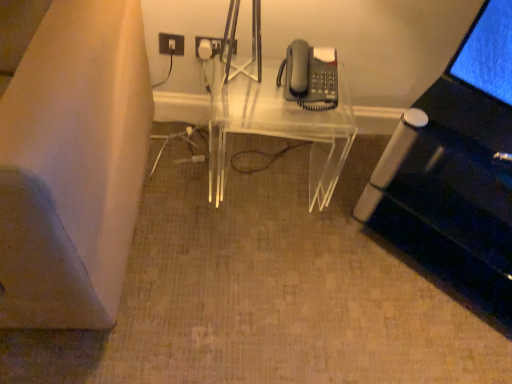
Question: Is transparent acrylic table at center at the back of white plastic electrical outlet at upper center?

Choices:
 (A) no
 (B) yes

Answer: (A)

Question: Is there a large distance between white plastic electrical outlet at upper center and transparent acrylic table at center?

Choices:
 (A) yes
 (B) no

Answer: (B)

Question: Is white plastic electrical outlet at upper center located outside transparent acrylic table at center?

Choices:
 (A) no
 (B) yes

Answer: (B)

Question: Is white plastic electrical outlet at upper center further to camera compared to transparent acrylic table at center?

Choices:
 (A) yes
 (B) no

Answer: (A)

Question: From the image's perspective, is white plastic electrical outlet at upper center under transparent acrylic table at center?

Choices:
 (A) yes
 (B) no

Answer: (B)

Question: From their relative heights in the image, would you say matte gray phone at upper right is taller or shorter than transparent acrylic table at center?

Choices:
 (A) tall
 (B) short

Answer: (B)

Question: In terms of size, does matte gray phone at upper right appear bigger or smaller than transparent acrylic table at center?

Choices:
 (A) small
 (B) big

Answer: (A)

Question: Is point (318, 89) positioned closer to the camera than point (226, 97)?

Choices:
 (A) closer
 (B) farther

Answer: (A)

Question: Visually, is matte gray phone at upper right positioned to the left or to the right of transparent acrylic table at center?

Choices:
 (A) right
 (B) left

Answer: (A)

Question: Is matte gray phone at upper right to the left or to the right of white plastic electrical outlet at upper center in the image?

Choices:
 (A) left
 (B) right

Answer: (B)

Question: From the image's perspective, is matte gray phone at upper right above or below white plastic electrical outlet at upper center?

Choices:
 (A) above
 (B) below

Answer: (B)

Question: In terms of size, does matte gray phone at upper right appear bigger or smaller than white plastic electrical outlet at upper center?

Choices:
 (A) small
 (B) big

Answer: (B)

Question: Considering the positions of matte gray phone at upper right and white plastic electrical outlet at upper center in the image, is matte gray phone at upper right wider or thinner than white plastic electrical outlet at upper center?

Choices:
 (A) thin
 (B) wide

Answer: (B)

Question: Looking at the image, does white plastic electrical outlet at upper center seem bigger or smaller compared to matte gray phone at upper right?

Choices:
 (A) big
 (B) small

Answer: (B)

Question: Do you think white plastic electrical outlet at upper center is within matte gray phone at upper right, or outside of it?

Choices:
 (A) outside
 (B) inside

Answer: (A)